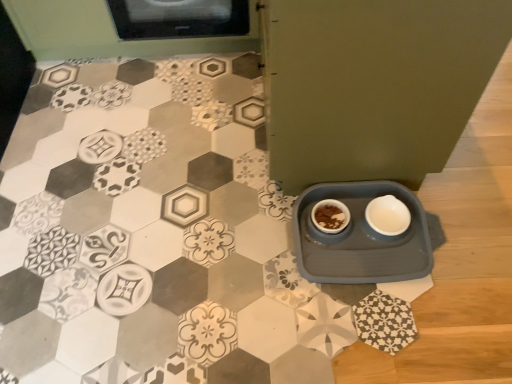
Question: From the image's perspective, is gray plastic tray at lower right located above or below brown matte bowl at center?

Choices:
 (A) above
 (B) below

Answer: (B)

Question: From a real-world perspective, relative to brown matte bowl at center, is gray plastic tray at lower right vertically above or below?

Choices:
 (A) below
 (B) above

Answer: (A)

Question: Which object is the closest to the white matte bowl at lower right?

Choices:
 (A) gray plastic tray at lower right
 (B) brown matte bowl at center

Answer: (A)

Question: Which object is the farthest from the white matte bowl at lower right?

Choices:
 (A) brown matte bowl at center
 (B) gray plastic tray at lower right

Answer: (A)